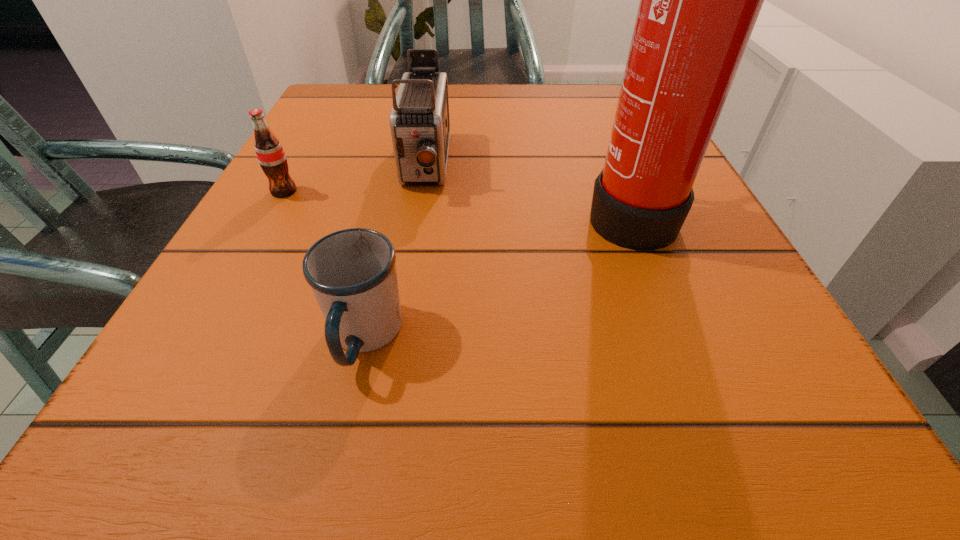
The height and width of the screenshot is (540, 960). I want to click on blank space at the far right corner, so click(x=582, y=98).

The image size is (960, 540). I want to click on vacant area that lies between the leftmost object and the third shortest object, so click(354, 178).

Locate an element on the screen. The image size is (960, 540). vacant space that's between the mug and the camcorder is located at coordinates pyautogui.click(x=396, y=251).

I want to click on free space between the leftmost object and the third shortest object, so click(x=354, y=178).

Locate an element on the screen. unoccupied area between the soda and the fire extinguisher is located at coordinates 457,202.

Where is `free spot between the soda and the rightmost object`? free spot between the soda and the rightmost object is located at coordinates (457, 202).

Where is `free space that is in between the soda and the camcorder`? free space that is in between the soda and the camcorder is located at coordinates (354, 178).

Locate an element on the screen. The image size is (960, 540). free space that is in between the fire extinguisher and the shortest object is located at coordinates (497, 275).

In order to click on free space that is in between the mug and the rightmost object in this screenshot , I will do `click(497, 275)`.

Locate an element on the screen. The height and width of the screenshot is (540, 960). free spot between the third tallest object and the second tallest object is located at coordinates (354, 178).